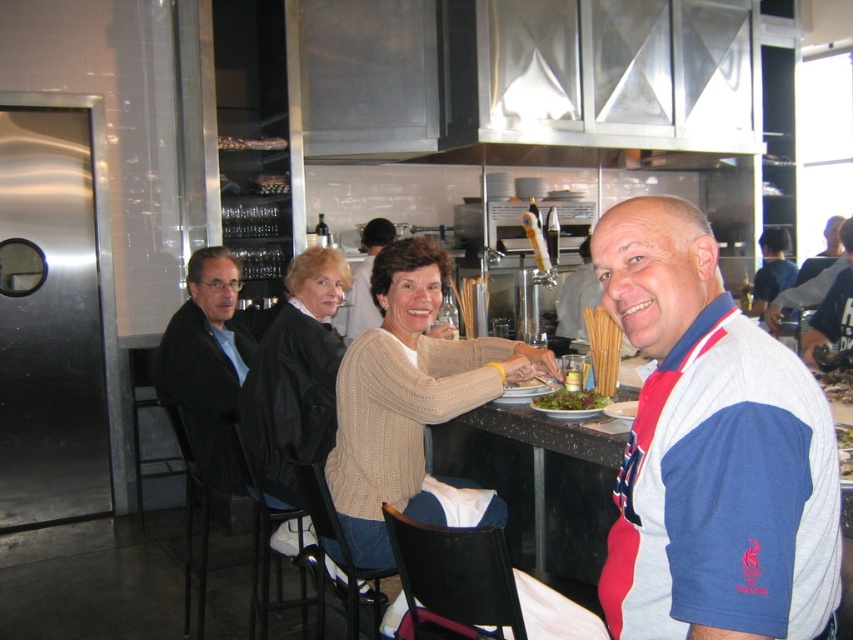
You are a customer looking at the two people sitting at the counter. Which person is wearing the blue and white polo shirt at right and is positioned lower than the blue cotton shirt at upper right?

The blue and white polo shirt at right is below the blue cotton shirt at upper right, so the person wearing the blue and white polo shirt at right is positioned lower.

You are a chef in the kitchen and need to hand a recipe to both the person wearing the matte black sweater at center and the blue cotton shirt at upper right. Which person is closer to the counter where you are standing?

The matte black sweater at center is closer to the counter where you are standing because it is located below the blue cotton shirt at upper right, indicating a lower position relative to the counter.